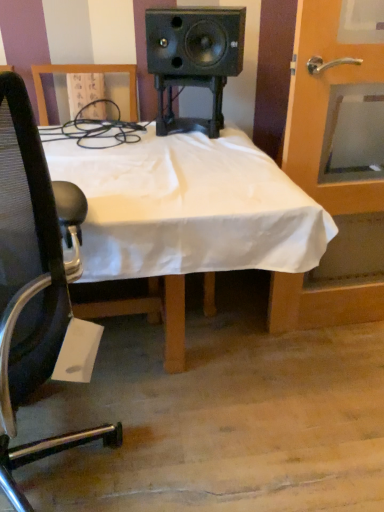
At what (x,y) coordinates should I click in order to perform the action: click on free point to the left of wooden door at right. Please return your answer as a coordinate pair (x, y). This screenshot has height=512, width=384. Looking at the image, I should click on (250, 347).